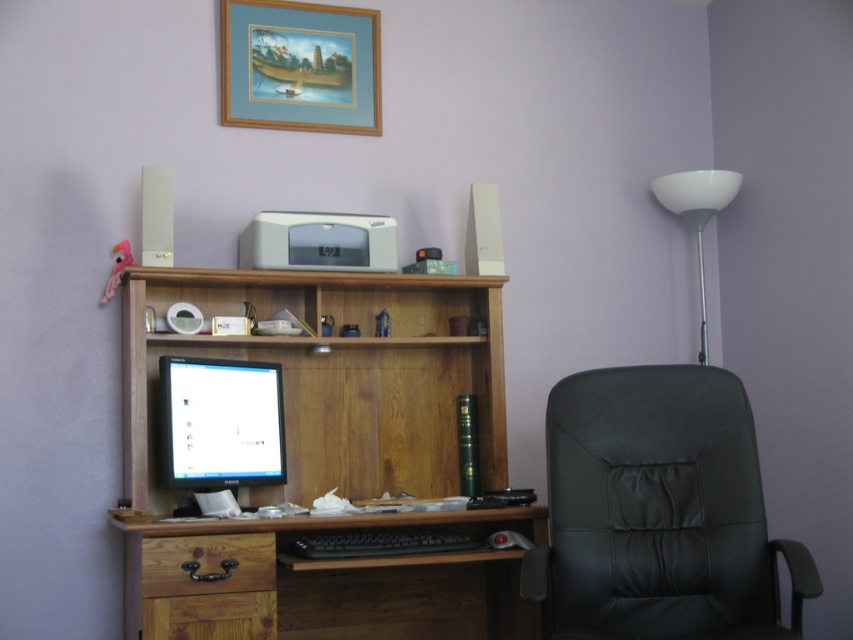
Is brown wood drawer at lower center to the left of white plastic floor lamp at upper right from the viewer's perspective?

Indeed, brown wood drawer at lower center is positioned on the left side of white plastic floor lamp at upper right.

Is point (196, 540) farther from camera compared to point (679, 209)?

No, it is in front of (679, 209).

At what (x,y) coordinates should I click in order to perform the action: click on brown wood drawer at lower center. Please return your answer as a coordinate pair (x, y). The width and height of the screenshot is (853, 640). Looking at the image, I should click on (207, 563).

Who is more distant from viewer, (701, 524) or (735, 176)?

Positioned behind is point (735, 176).

The width and height of the screenshot is (853, 640). What do you see at coordinates (659, 513) in the screenshot?
I see `black leather swivel chair at right` at bounding box center [659, 513].

The width and height of the screenshot is (853, 640). I want to click on black leather swivel chair at right, so click(659, 513).

Who is positioned more to the right, gold wooden picture frame at upper center or matte gray printer at center?

matte gray printer at center is more to the right.

Who is shorter, gold wooden picture frame at upper center or matte gray printer at center?

With less height is matte gray printer at center.

Who is more forward, (323, 52) or (381, 243)?

Point (381, 243)

Locate an element on the screen. This screenshot has height=640, width=853. gold wooden picture frame at upper center is located at coordinates (299, 67).